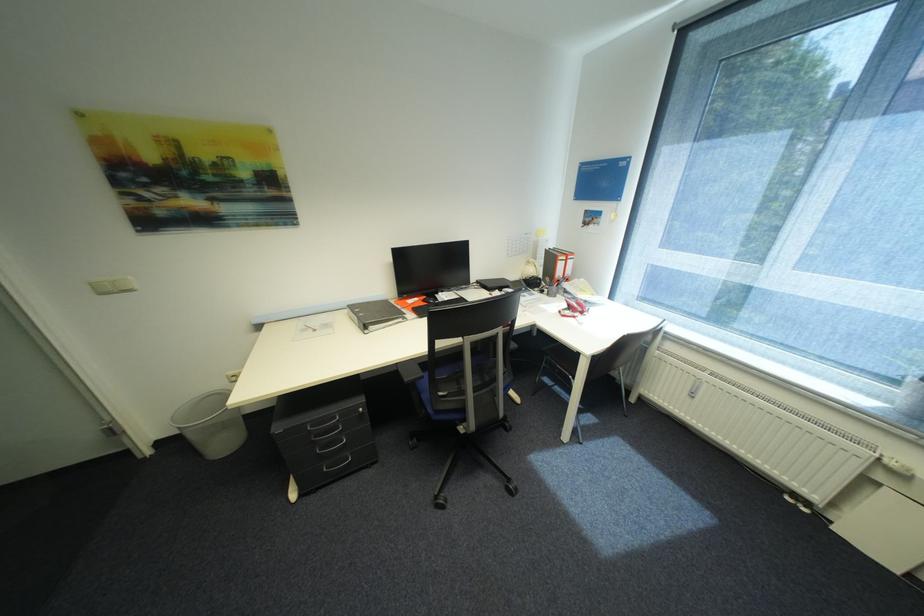
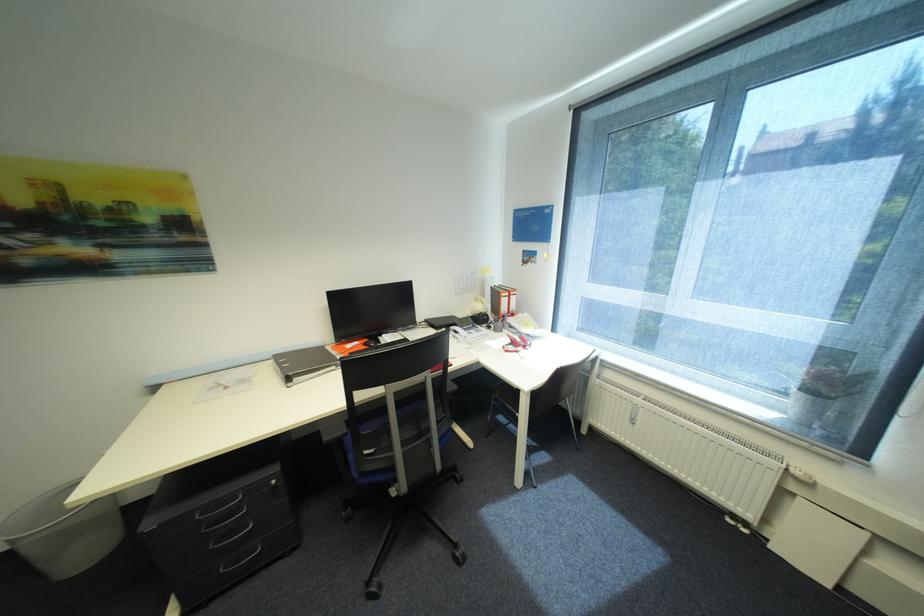
Locate, in the second image, the point that corresponds to point (550, 292) in the first image.

(496, 328)